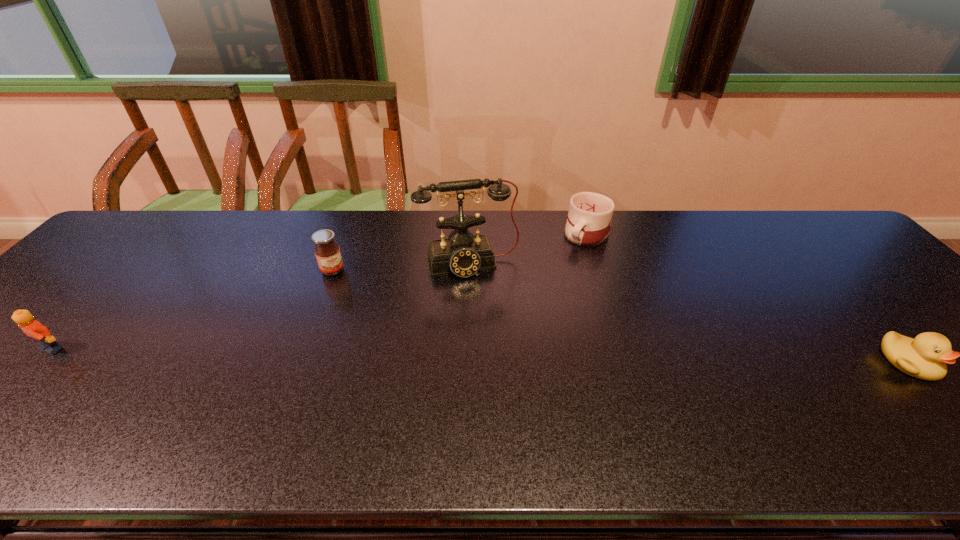
Identify the location of free spot located 0.390m on the dial of the telephone. The width and height of the screenshot is (960, 540). (513, 401).

Locate an element on the screen. This screenshot has height=540, width=960. vacant space located on the label side of the jam is located at coordinates (393, 349).

Locate an element on the screen. The width and height of the screenshot is (960, 540). vacant space located on the label side of the jam is located at coordinates (370, 319).

What are the coordinates of `vacant area situated on the label side of the jam` in the screenshot? It's located at (391, 347).

This screenshot has width=960, height=540. I want to click on blank space located on the side with the handle of the second object from right to left, so click(x=558, y=263).

Identify the location of free space located on the side with the handle of the second object from right to left. (504, 310).

This screenshot has height=540, width=960. I want to click on free space located 0.320m on the side with the handle of the second object from right to left, so click(x=512, y=305).

This screenshot has width=960, height=540. Find the location of `telephone that is at the far edge`. telephone that is at the far edge is located at coordinates (464, 254).

Identify the location of mug at the far edge. The height and width of the screenshot is (540, 960). (590, 214).

Locate an element on the screen. The image size is (960, 540). object that is at the near edge is located at coordinates [x=925, y=357].